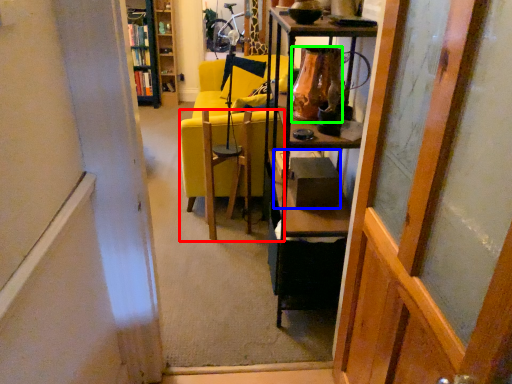
Question: Estimate the real-world distances between objects in this image. Which object is farther from chair (highlighted by a red box), box (highlighted by a blue box) or vase (highlighted by a green box)?

Choices:
 (A) box
 (B) vase

Answer: (B)